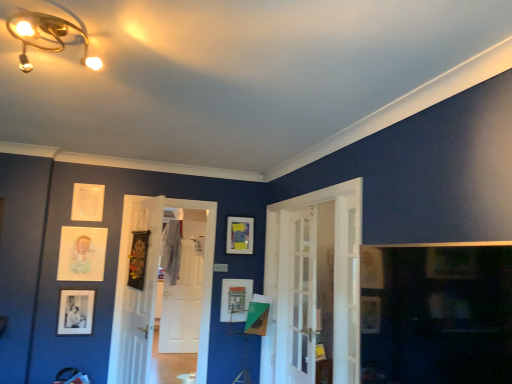
What do you see at coordinates (302, 297) in the screenshot?
I see `clear glass screen door at center` at bounding box center [302, 297].

Locate an element on the screen. The width and height of the screenshot is (512, 384). white wooden door at center, positioned as the third door in right-to-left order is located at coordinates (136, 292).

What do you see at coordinates (48, 36) in the screenshot? I see `gold metallic light fixture at upper left` at bounding box center [48, 36].

Describe the element at coordinates (234, 299) in the screenshot. I see `matte white picture frame at center, arranged as the 2th picture frame when viewed from the right` at that location.

You are a GUI agent. You are given a task and a screenshot of the screen. Output one action in this format:
    pyautogui.click(x=<x>, y=<y>)
    Task: Click on the white matte door at center, positioned as the second door in left-to-right order
    The width and height of the screenshot is (512, 384).
    Given the screenshot: What is the action you would take?
    pyautogui.click(x=180, y=292)

Where is `matte yellow picture frame at center, arranged as the 1th picture frame when viewed from the right`? This screenshot has height=384, width=512. matte yellow picture frame at center, arranged as the 1th picture frame when viewed from the right is located at coordinates (240, 235).

Considering the positions of objects wooden textured picture frame at center, which is counted as the 3th picture frame, starting from the right, and matte white picture frame at center, which is counted as the 4th picture frame, starting from the left, in the image provided, who is more to the left, wooden textured picture frame at center, which is counted as the 3th picture frame, starting from the right, or matte white picture frame at center, which is counted as the 4th picture frame, starting from the left,?

wooden textured picture frame at center, which is counted as the 3th picture frame, starting from the right.

Considering the relative sizes of wooden textured picture frame at center, the third picture frame from the left, and matte white picture frame at center, arranged as the 2th picture frame when viewed from the right, in the image provided, is wooden textured picture frame at center, the third picture frame from the left, smaller than matte white picture frame at center, arranged as the 2th picture frame when viewed from the right,?

Actually, wooden textured picture frame at center, the third picture frame from the left, might be larger than matte white picture frame at center, arranged as the 2th picture frame when viewed from the right.

Can you confirm if wooden textured picture frame at center, the third picture frame from the left, is taller than matte white picture frame at center, arranged as the 2th picture frame when viewed from the right?

Yes.

From the image's perspective, relative to matte white picture frame at center, arranged as the 2th picture frame when viewed from the right, is wooden textured picture frame at center, which is counted as the 3th picture frame, starting from the right, above or below?

Based on their image positions, wooden textured picture frame at center, which is counted as the 3th picture frame, starting from the right, is located above matte white picture frame at center, arranged as the 2th picture frame when viewed from the right.

In the scene shown: Is white glass door at center, placed as the 1th door when sorted from front to back, beside clear glass screen door at center?

There is a gap between white glass door at center, placed as the 1th door when sorted from front to back, and clear glass screen door at center.

There is a clear glass screen door at center. What are the coordinates of `the 1st door above it (from the image's perspective)` in the screenshot? It's located at (333, 281).

Looking at their sizes, would you say white glass door at center, placed as the 1th door when sorted from front to back, is wider or thinner than clear glass screen door at center?

In the image, white glass door at center, placed as the 1th door when sorted from front to back, appears to be wider than clear glass screen door at center.

I want to click on door that is the 3rd object to the right of the black matte picture frame at lower left, acting as the first picture frame starting from the left, starting at the anchor, so [333, 281].

Is black matte picture frame at lower left, acting as the first picture frame starting from the left, inside white glass door at center, which is counted as the 3th door, starting from the left?

No, black matte picture frame at lower left, acting as the first picture frame starting from the left, is located outside of white glass door at center, which is counted as the 3th door, starting from the left.

Is white glass door at center, the 1th door from the right, turned away from black matte picture frame at lower left, acting as the first picture frame starting from the left?

No.

Consider the image. Would you say white glass door at center, which is counted as the 3th door, starting from the left, is a long distance from black matte picture frame at lower left, acting as the first picture frame starting from the left?

white glass door at center, which is counted as the 3th door, starting from the left, is far away from black matte picture frame at lower left, acting as the first picture frame starting from the left.

Between point (58, 279) and point (245, 228), which one is positioned behind?

The point (245, 228) is farther.

Is matte paper picture frame at upper left, which is counted as the 2th picture frame, starting from the left, facing away from matte yellow picture frame at center, which is counted as the fifth picture frame, starting from the left?

No, matte paper picture frame at upper left, which is counted as the 2th picture frame, starting from the left, is not facing away from matte yellow picture frame at center, which is counted as the fifth picture frame, starting from the left.

How different are the orientations of matte paper picture frame at upper left, arranged as the fourth picture frame when viewed from the right, and matte yellow picture frame at center, arranged as the 1th picture frame when viewed from the right, in degrees?

The angular difference between matte paper picture frame at upper left, arranged as the fourth picture frame when viewed from the right, and matte yellow picture frame at center, arranged as the 1th picture frame when viewed from the right, is 5.73 degrees.

From a real-world perspective, between matte paper picture frame at upper left, arranged as the fourth picture frame when viewed from the right, and matte yellow picture frame at center, which is counted as the fifth picture frame, starting from the left, who is vertically higher?

matte yellow picture frame at center, which is counted as the fifth picture frame, starting from the left.

Looking at this image, from the image's perspective, is matte yellow picture frame at center, which is counted as the fifth picture frame, starting from the left, positioned above or below matte white picture frame at center, which is counted as the 4th picture frame, starting from the left?

Clearly, from the image's perspective, matte yellow picture frame at center, which is counted as the fifth picture frame, starting from the left, is above matte white picture frame at center, which is counted as the 4th picture frame, starting from the left.

Is matte yellow picture frame at center, arranged as the 1th picture frame when viewed from the right, to the left or to the right of matte white picture frame at center, arranged as the 2th picture frame when viewed from the right, in the image?

From the image, it's evident that matte yellow picture frame at center, arranged as the 1th picture frame when viewed from the right, is to the right of matte white picture frame at center, arranged as the 2th picture frame when viewed from the right.

Is matte yellow picture frame at center, which is counted as the fifth picture frame, starting from the left, taller than matte white picture frame at center, arranged as the 2th picture frame when viewed from the right?

Incorrect, the height of matte yellow picture frame at center, which is counted as the fifth picture frame, starting from the left, is not larger of that of matte white picture frame at center, arranged as the 2th picture frame when viewed from the right.

Does matte yellow picture frame at center, arranged as the 1th picture frame when viewed from the right, contain matte white picture frame at center, arranged as the 2th picture frame when viewed from the right?

No.

Considering the relative sizes of white wooden door at center, the second door from the front, and gold metallic light fixture at upper left in the image provided, is white wooden door at center, the second door from the front, shorter than gold metallic light fixture at upper left?

No.

Is white wooden door at center, the second door from the front, directly adjacent to gold metallic light fixture at upper left?

No.

Choose the correct answer: Is white wooden door at center, positioned as the third door in right-to-left order, inside gold metallic light fixture at upper left or outside it?

white wooden door at center, positioned as the third door in right-to-left order, is not enclosed by gold metallic light fixture at upper left.

Is white wooden door at center, the second door from the front, facing away from gold metallic light fixture at upper left?

No.

Identify the location of door directly beneath the white wooden door at center, the 1th door viewed from the left (from a real-world perspective). The width and height of the screenshot is (512, 384). pos(180,292).

Is the depth of white matte door at center, positioned as the second door in left-to-right order, less than that of white wooden door at center, the 1th door viewed from the left?

That is False.

Would you say white matte door at center, which ranks as the 1th door in back-to-front order, contains white wooden door at center, positioned as the 2th door in back-to-front order?

That's incorrect, white wooden door at center, positioned as the 2th door in back-to-front order, is not inside white matte door at center, which ranks as the 1th door in back-to-front order.

From the image's perspective, count 2nd picture frames upward from the matte white picture frame at center, which is counted as the 4th picture frame, starting from the left, and point to it. Please provide its 2D coordinates.

[(138, 259)]

Where is `door that is the 2nd one when counting forward from the clear glass screen door at center`? door that is the 2nd one when counting forward from the clear glass screen door at center is located at coordinates (333, 281).

Looking at the image, which one is located further to matte paper picture frame at upper left, arranged as the fourth picture frame when viewed from the right, white matte door at center, which ranks as the 3th door in front-to-back order, or wooden textured picture frame at center, the third picture frame from the left?

The object further to matte paper picture frame at upper left, arranged as the fourth picture frame when viewed from the right, is white matte door at center, which ranks as the 3th door in front-to-back order.

Estimate the real-world distances between objects in this image. Which object is further from white wooden door at center, the 1th door viewed from the left, matte yellow picture frame at center, which is counted as the fifth picture frame, starting from the left, or white matte door at center, which ranks as the 1th door in back-to-front order?

white matte door at center, which ranks as the 1th door in back-to-front order, is positioned further to the anchor white wooden door at center, the 1th door viewed from the left.

From the image, which object appears to be farther from matte white picture frame at center, which is counted as the 4th picture frame, starting from the left, wooden textured picture frame at center, the third picture frame from the left, or black matte picture frame at lower left, the 5th picture frame viewed from the right?

The object further to matte white picture frame at center, which is counted as the 4th picture frame, starting from the left, is black matte picture frame at lower left, the 5th picture frame viewed from the right.

When comparing their distances from white glass door at center, which is counted as the 3th door, starting from the left, does wooden textured picture frame at center, the third picture frame from the left, or black matte picture frame at lower left, the 5th picture frame viewed from the right, seem closer?

wooden textured picture frame at center, the third picture frame from the left, lies closer to white glass door at center, which is counted as the 3th door, starting from the left, than the other object.

Which object lies further to the anchor point matte yellow picture frame at center, arranged as the 1th picture frame when viewed from the right, wooden textured picture frame at center, which is counted as the 3th picture frame, starting from the right, or white matte door at center, which ranks as the 1th door in back-to-front order?

white matte door at center, which ranks as the 1th door in back-to-front order, is positioned further to the anchor matte yellow picture frame at center, arranged as the 1th picture frame when viewed from the right.

Based on their spatial positions, is matte paper picture frame at upper left, which is counted as the 2th picture frame, starting from the left, or white matte door at center, which ranks as the 3th door in front-to-back order, further from wooden textured picture frame at center, which is counted as the 3th picture frame, starting from the right?

white matte door at center, which ranks as the 3th door in front-to-back order, lies further to wooden textured picture frame at center, which is counted as the 3th picture frame, starting from the right, than the other object.

Considering their positions, is matte white picture frame at center, which is counted as the 4th picture frame, starting from the left, positioned further to white glass door at center, which is counted as the 3th door, starting from the left, than black matte picture frame at lower left, the 5th picture frame viewed from the right?

black matte picture frame at lower left, the 5th picture frame viewed from the right.

Considering their positions, is matte yellow picture frame at center, arranged as the 1th picture frame when viewed from the right, positioned further to gold metallic light fixture at upper left than matte white picture frame at center, which is counted as the 4th picture frame, starting from the left?

The object further to gold metallic light fixture at upper left is matte white picture frame at center, which is counted as the 4th picture frame, starting from the left.

Find the location of a particular element. Image resolution: width=512 pixels, height=384 pixels. screen door situated between matte paper picture frame at upper left, arranged as the fourth picture frame when viewed from the right, and white glass door at center, which is counted as the 3th door, starting from the left, from left to right is located at coordinates (302, 297).

You are a GUI agent. You are given a task and a screenshot of the screen. Output one action in this format:
    pyautogui.click(x=<x>, y=<y>)
    Task: Click on the screen door between white wooden door at center, positioned as the third door in right-to-left order, and white glass door at center, which is counted as the 3th door, starting from the left, from left to right
    The height and width of the screenshot is (384, 512).
    Given the screenshot: What is the action you would take?
    pyautogui.click(x=302, y=297)

This screenshot has width=512, height=384. In order to click on picture frame between matte paper picture frame at upper left, arranged as the fourth picture frame when viewed from the right, and white wooden door at center, positioned as the 2th door in back-to-front order, from left to right in this screenshot , I will do `click(138, 259)`.

I want to click on picture frame situated between wooden textured picture frame at center, the third picture frame from the left, and matte yellow picture frame at center, arranged as the 1th picture frame when viewed from the right, from left to right, so click(x=234, y=299).